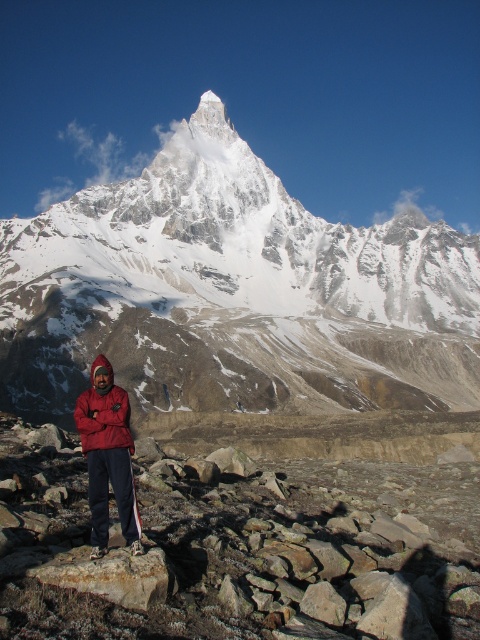
Does snowy granite peak at upper center have a larger size compared to matte red jacket at lower left?

Correct, snowy granite peak at upper center is larger in size than matte red jacket at lower left.

Between snowy granite peak at upper center and matte red jacket at lower left, which one has more height?

Standing taller between the two is snowy granite peak at upper center.

Who is more forward, (298, 330) or (129, 483)?

Point (129, 483) is in front.

Locate an element on the screen. Image resolution: width=480 pixels, height=640 pixels. snowy granite peak at upper center is located at coordinates point(233,292).

Can you confirm if snowy granite peak at upper center is taller than red fleece jacket at lower left?

Yes.

Between snowy granite peak at upper center and red fleece jacket at lower left, which one appears on the left side from the viewer's perspective?

Positioned to the left is red fleece jacket at lower left.

Which is behind, point (228, 154) or point (120, 397)?

The point (228, 154) is behind.

Locate an element on the screen. snowy granite peak at upper center is located at coordinates (233, 292).

Who is more forward, [120,486] or [86,396]?

Point [120,486]

From the picture: Can you confirm if matte red jacket at lower left is wider than red fleece jacket at lower left?

No.

Locate an element on the screen. matte red jacket at lower left is located at coordinates (108, 456).